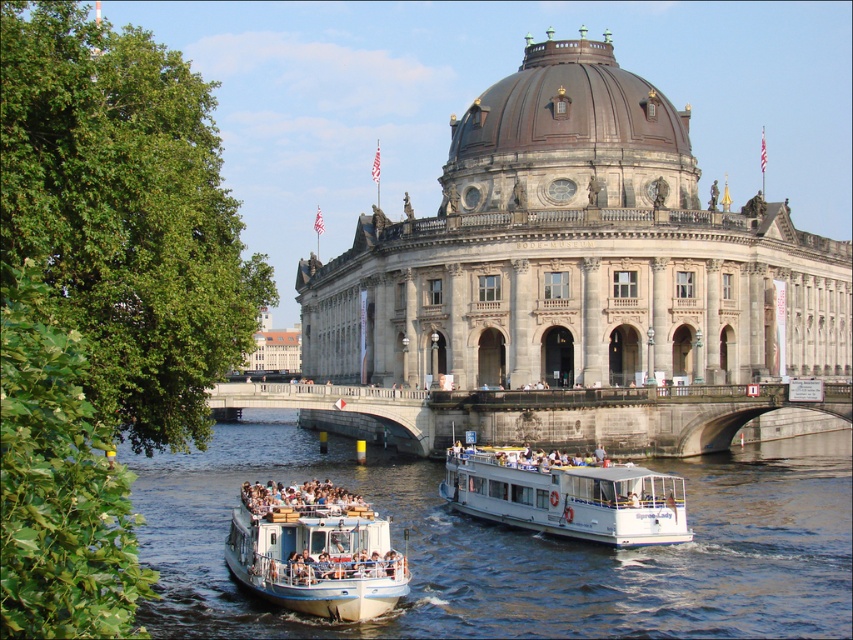
Question: Is stone bridge at center positioned in front of white matte boat at lower left?

Choices:
 (A) yes
 (B) no

Answer: (B)

Question: In this image, where is stone bridge at center located relative to white matte boat at center?

Choices:
 (A) below
 (B) above

Answer: (B)

Question: Which point is closer to the camera?

Choices:
 (A) (485, 620)
 (B) (781, 394)
 (C) (682, 289)
 (D) (654, 492)

Answer: (A)

Question: Which point is farther from the camera taking this photo?

Choices:
 (A) (682, 461)
 (B) (524, 449)
 (C) (350, 400)
 (D) (354, 515)

Answer: (C)

Question: Which object is the closest to the white matte boat at center?

Choices:
 (A) stone bridge at center
 (B) gray stone building at center
 (C) white matte boat at lower left
 (D) blue water at lower center

Answer: (D)

Question: Can you confirm if gray stone building at center is smaller than white matte boat at lower left?

Choices:
 (A) yes
 (B) no

Answer: (B)